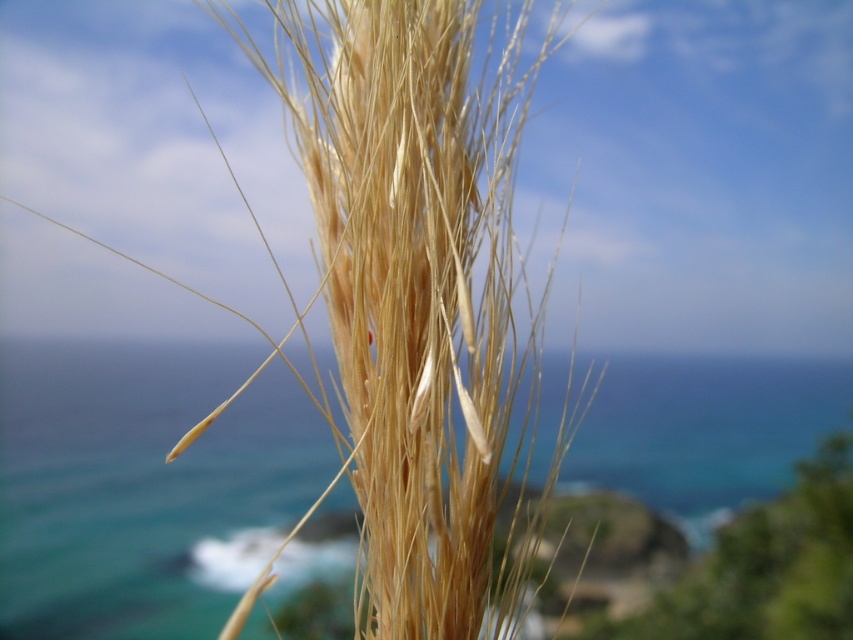
Question: Which point is farther to the camera?

Choices:
 (A) blue water at center
 (B) golden straw reed at center

Answer: (A)

Question: Considering the relative positions of golden straw reed at center and blue water at center in the image provided, where is golden straw reed at center located with respect to blue water at center?

Choices:
 (A) below
 (B) above

Answer: (B)

Question: Among these objects, which one is farthest from the camera?

Choices:
 (A) golden straw reed at center
 (B) blue water at center

Answer: (B)

Question: From the image, what is the correct spatial relationship of golden straw reed at center in relation to blue water at center?

Choices:
 (A) right
 (B) left

Answer: (A)

Question: Is golden straw reed at center further to camera compared to blue water at center?

Choices:
 (A) yes
 (B) no

Answer: (B)

Question: Among these objects, which one is farthest from the camera?

Choices:
 (A) golden straw reed at center
 (B) blue water at center

Answer: (B)